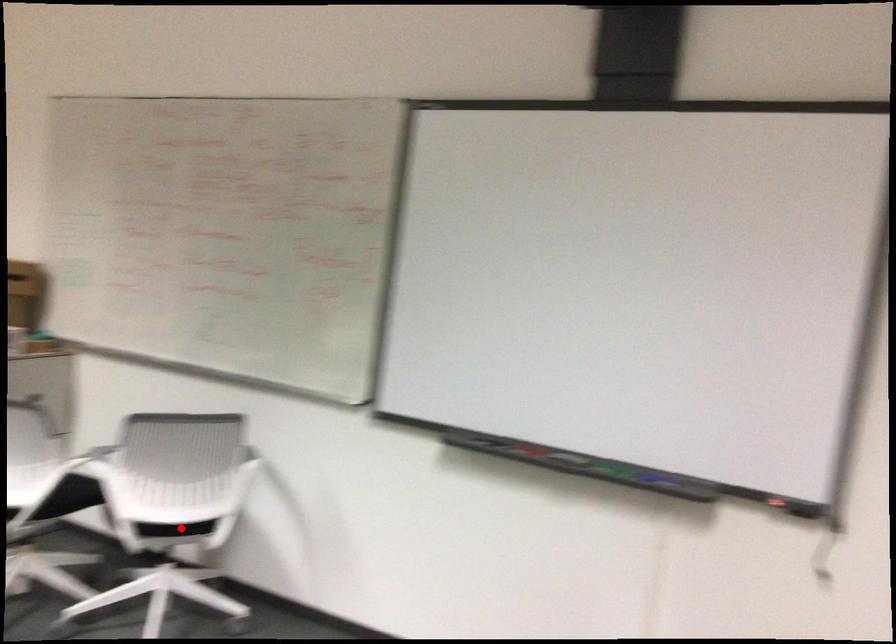
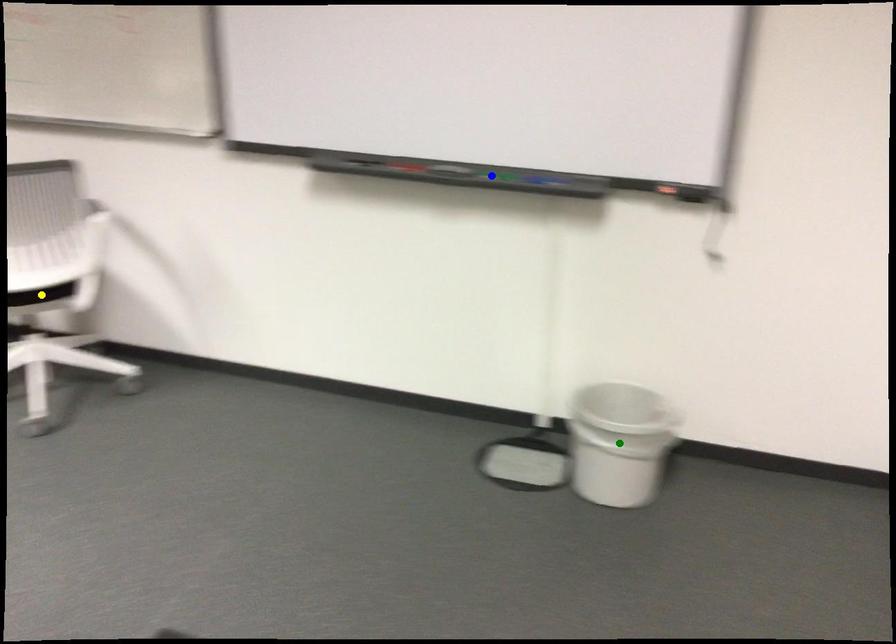
Question: I am providing you with two images of the same scene from different viewpoints. A red point is marked on the first image. You are given multiple points on the second image. Which mark in image 2 goes with the point in image 1?

Choices:
 (A) blue point
 (B) green point
 (C) yellow point

Answer: (C)